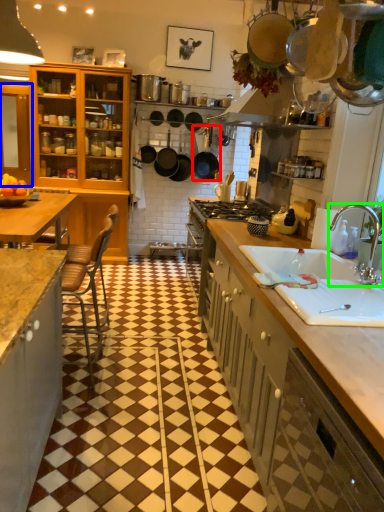
Question: Which is nearer to the kitchen appliance (highlighted by a red box)? cabinetry (highlighted by a blue box) or tap (highlighted by a green box).

Choices:
 (A) cabinetry
 (B) tap

Answer: (A)